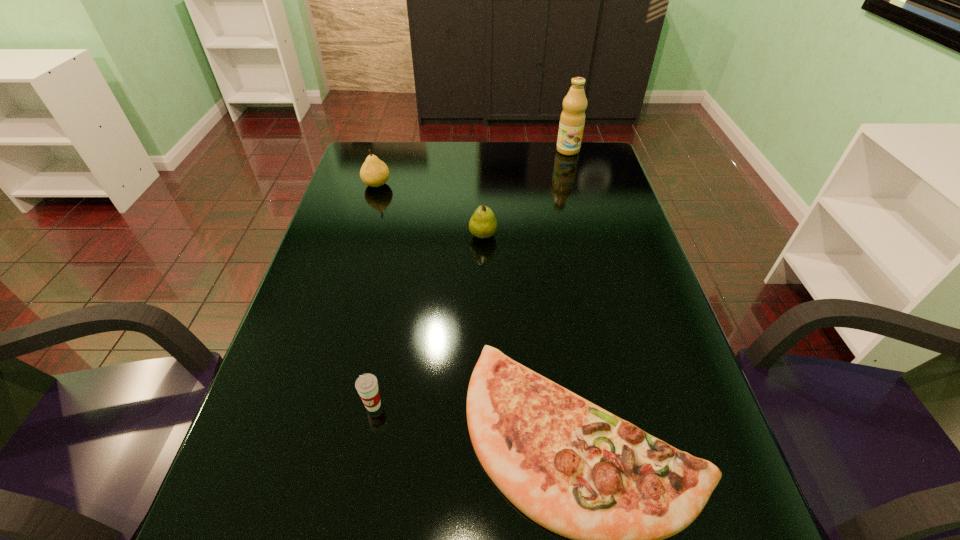
This screenshot has height=540, width=960. In order to click on free space at the far left corner of the desktop in this screenshot , I will do `click(378, 158)`.

Identify the location of free region at the far right corner. point(600,152).

Locate an element on the screen. This screenshot has height=540, width=960. free space between the shorter pear and the second object from left to right is located at coordinates (428, 320).

The height and width of the screenshot is (540, 960). Identify the location of unoccupied position between the fourth object from right to left and the olive oil. (470, 278).

The height and width of the screenshot is (540, 960). I want to click on free spot between the cup and the leftmost object, so click(375, 295).

You are a GUI agent. You are given a task and a screenshot of the screen. Output one action in this format:
    pyautogui.click(x=<x>, y=<y>)
    Task: Click on the vacant point located between the olive oil and the left pear
    The height and width of the screenshot is (540, 960).
    Given the screenshot: What is the action you would take?
    pyautogui.click(x=472, y=167)

Locate an element on the screen. vacant space in between the left pear and the third nearest object is located at coordinates (430, 210).

This screenshot has width=960, height=540. Find the location of `vacant area between the third farthest object and the second farthest object`. vacant area between the third farthest object and the second farthest object is located at coordinates (430, 210).

Locate an element on the screen. This screenshot has width=960, height=540. free space between the tallest object and the leftmost object is located at coordinates (472, 167).

Where is `vacant point located between the third farthest object and the tallest object`? Image resolution: width=960 pixels, height=540 pixels. vacant point located between the third farthest object and the tallest object is located at coordinates (525, 193).